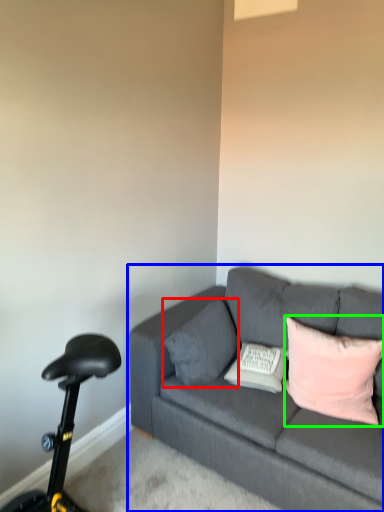
Question: Estimate the real-world distances between objects in this image. Which object is farther from pillow (highlighted by a red box), studio couch (highlighted by a blue box) or pillow (highlighted by a green box)?

Choices:
 (A) studio couch
 (B) pillow

Answer: (B)